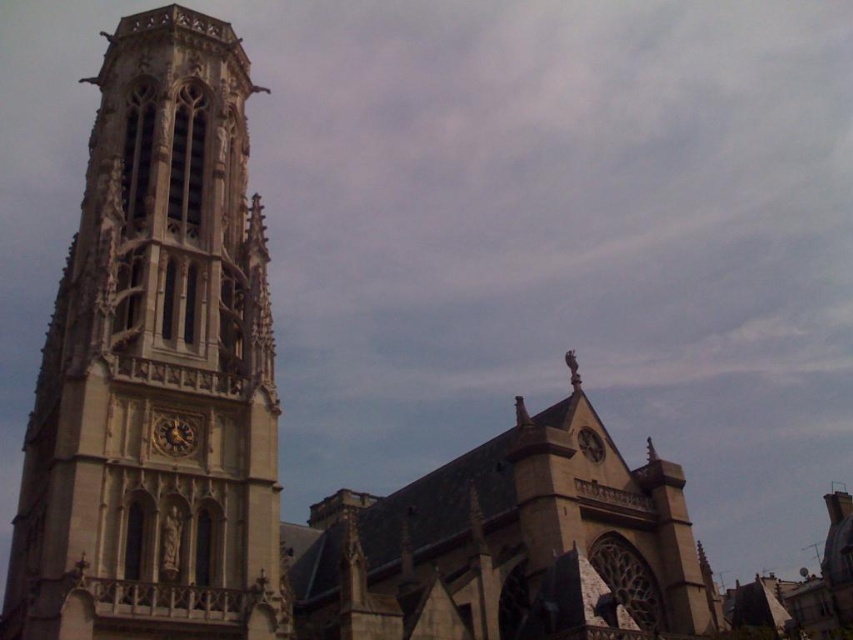
Question: Is gold metallic clock at center-left bigger than golden polished clock at upper center?

Choices:
 (A) no
 (B) yes

Answer: (B)

Question: Does beige stone tower at left appear on the left side of golden polished clock at upper center?

Choices:
 (A) no
 (B) yes

Answer: (B)

Question: Is gold metallic clock at center-left to the left of golden polished clock at upper center from the viewer's perspective?

Choices:
 (A) no
 (B) yes

Answer: (B)

Question: Which of the following is the closest to the observer?

Choices:
 (A) golden polished clock at upper center
 (B) beige stone tower at left

Answer: (B)

Question: Among these points, which one is nearest to the camera?

Choices:
 (A) (160, 428)
 (B) (212, 193)
 (C) (578, 436)

Answer: (A)

Question: Which object is the closest to the golden polished clock at upper center?

Choices:
 (A) gold metallic clock at center-left
 (B) beige stone tower at left

Answer: (A)